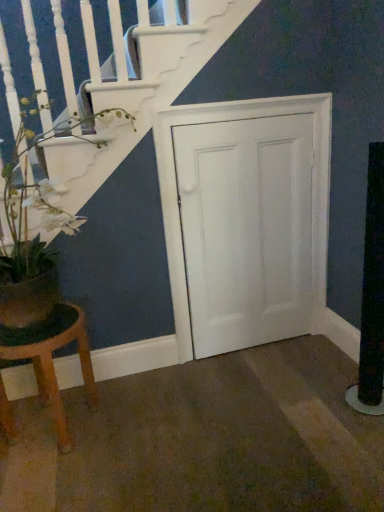
Where is `vacant point above white wood door at center (from a real-world perspective)`? The height and width of the screenshot is (512, 384). vacant point above white wood door at center (from a real-world perspective) is located at coordinates (244, 119).